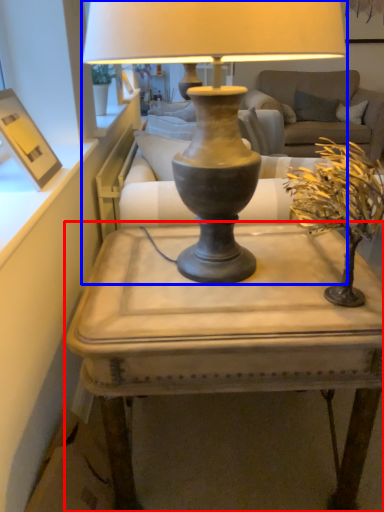
Question: Among these objects, which one is nearest to the camera, table (highlighted by a red box) or lamp (highlighted by a blue box)?

Choices:
 (A) table
 (B) lamp

Answer: (B)